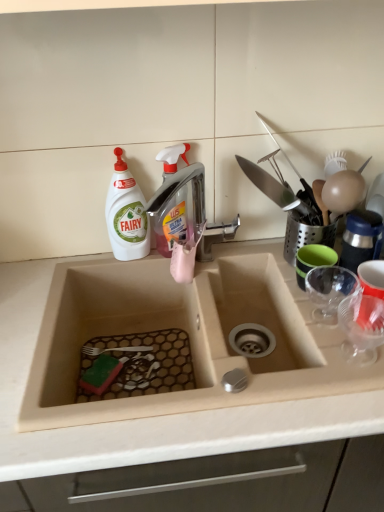
Find the location of a particular element. The width and height of the screenshot is (384, 512). free space to the back side of transparent plastic cup at right, which ranks as the third tableware in back-to-front order is located at coordinates (322, 314).